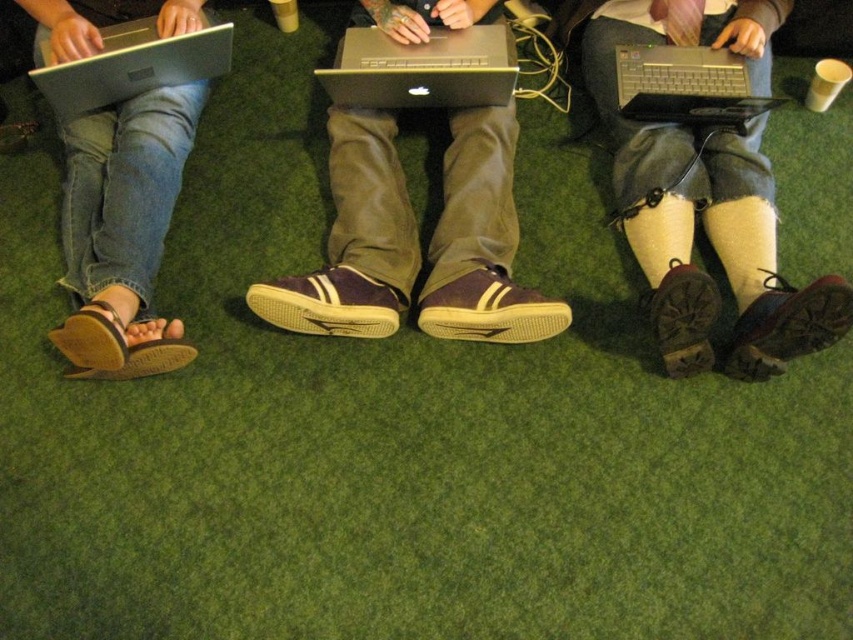
Question: Which object is positioned farthest from the black plastic keyboard at center?

Choices:
 (A) brown suede shoe at lower right
 (B) brown suede shoe at center
 (C) dark brown leather boots at lower right

Answer: (B)

Question: Which object is closer to the camera taking this photo?

Choices:
 (A) silver metallic laptop at center
 (B) brown leather sandals at lower left
 (C) silver metallic laptop at left
 (D) brown suede shoe at lower right

Answer: (D)

Question: Which object is the closest to the brown suede shoe at center?

Choices:
 (A) brown suede shoe at lower right
 (B) dark brown leather boots at lower right

Answer: (B)

Question: Where is purple suede shoes at center located in relation to leather boot at lower right in the image?

Choices:
 (A) left
 (B) right

Answer: (A)

Question: Is black plastic keyboard at center positioned in front of brown leather sandal at lower left?

Choices:
 (A) no
 (B) yes

Answer: (A)

Question: Can you confirm if dark brown leather boots at lower right is wider than brown suede shoe at center?

Choices:
 (A) yes
 (B) no

Answer: (A)